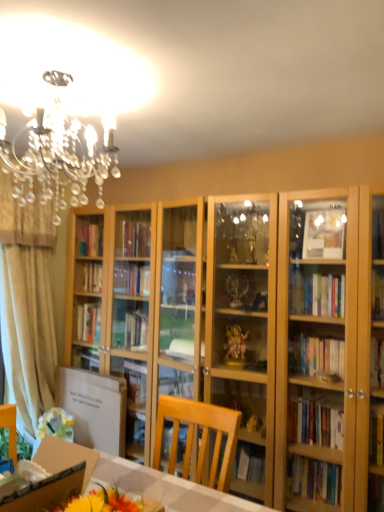
Question: From the image's perspective, is white cardboard box at lower left positioned above or below beige fabric curtain at left?

Choices:
 (A) above
 (B) below

Answer: (B)

Question: Looking at the image, does white cardboard box at lower left seem bigger or smaller compared to beige fabric curtain at left?

Choices:
 (A) small
 (B) big

Answer: (A)

Question: Considering the real-world distances, which object is closest to the wooden desk at lower left?

Choices:
 (A) beige fabric curtain at left
 (B) white cardboard box at lower left

Answer: (B)

Question: Considering the real-world distances, which object is closest to the white cardboard box at lower left?

Choices:
 (A) wooden desk at lower left
 (B) beige fabric curtain at left

Answer: (A)